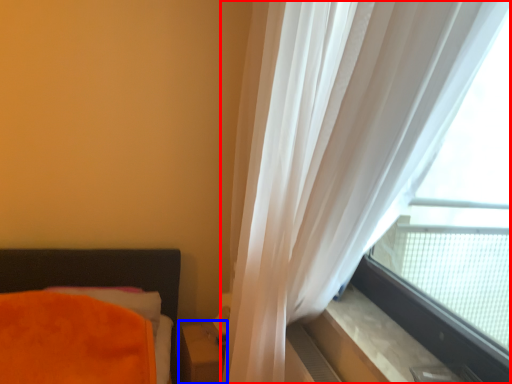
Question: Which of the following is the farthest to the observer, curtain (highlighted by a red box) or table (highlighted by a blue box)?

Choices:
 (A) curtain
 (B) table

Answer: (B)